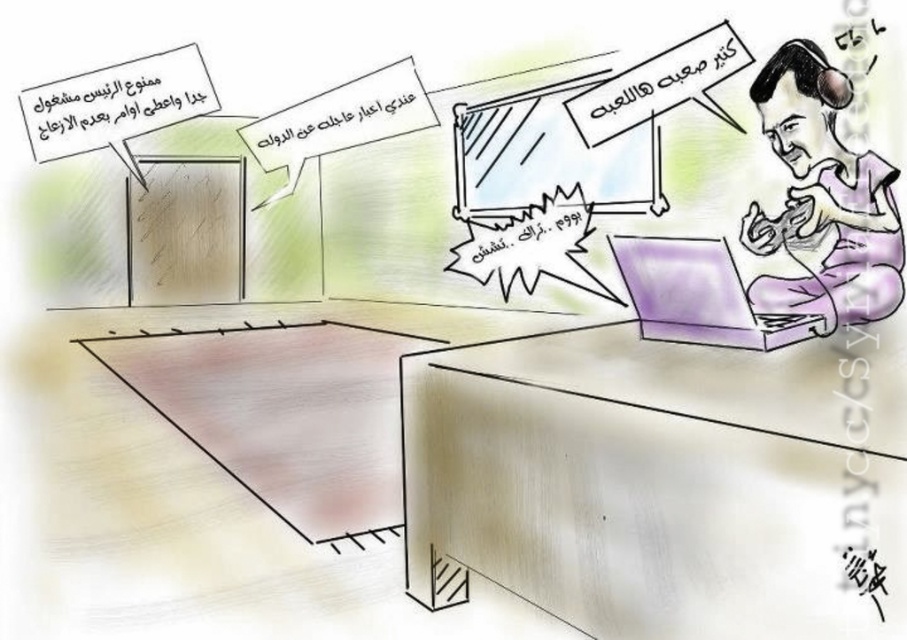
You are a delivery person who needs to place a package on the floor between the purple matte laptop at right and the white paper sign at upper right. The package is 16 inches long. Can you fit it there without moving either object?

The distance between the purple matte laptop at right and the white paper sign at upper right is 32.37 inches. Since the package is 16 inches long, it can easily fit in the space between them.

Where is the purple matte shirt at upper right located in the image?

The purple matte shirt at upper right is located at point [822,198] in the image.